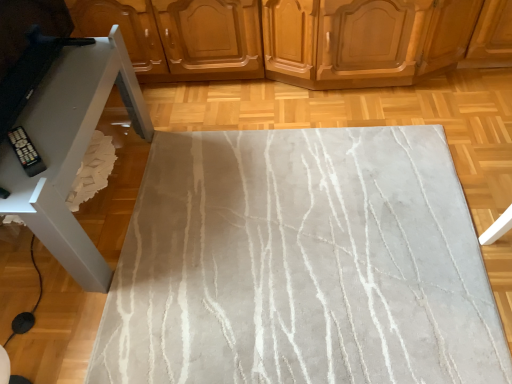
At what (x,y) coordinates should I click in order to perform the action: click on white glossy tv stand at left. Please return your answer as a coordinate pair (x, y). Image resolution: width=512 pixels, height=384 pixels. Looking at the image, I should click on (70, 149).

What is the approximate height of white glossy tv stand at left?

The height of white glossy tv stand at left is 19.85 inches.

What do you see at coordinates (70, 149) in the screenshot?
I see `white glossy tv stand at left` at bounding box center [70, 149].

Locate an element on the screen. white glossy tv stand at left is located at coordinates [70, 149].